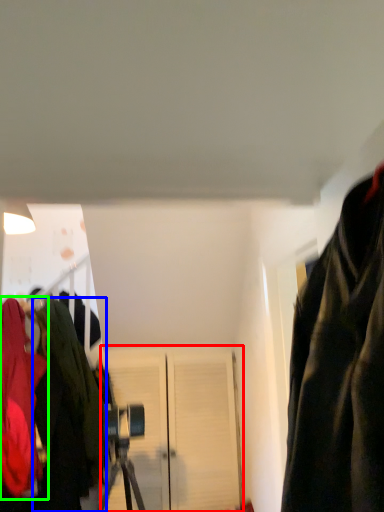
Question: Based on their relative distances, which object is nearer to door (highlighted by a red box)? Choose from jacket (highlighted by a blue box) and jacket (highlighted by a green box).

Choices:
 (A) jacket
 (B) jacket

Answer: (A)